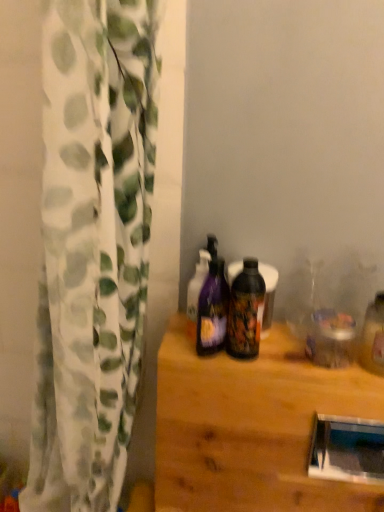
What is the approximate width of wooden table at center?

It is 7.88 inches.

How much space does purple glossy bottle at center, the 2th bottle when ordered from right to left, occupy horizontally?

The width of purple glossy bottle at center, the 2th bottle when ordered from right to left, is 2.33 inches.

What do you see at coordinates (246, 311) in the screenshot? I see `glossy plastic bottle at center, the first bottle in the right-to-left sequence` at bounding box center [246, 311].

Locate an element on the screen. The image size is (384, 512). wooden table at center is located at coordinates tap(252, 426).

Could wooden table at center be considered to be inside white textured curtain at left?

No, wooden table at center is located outside of white textured curtain at left.

At what (x,y) coordinates should I click in order to perform the action: click on table below the white textured curtain at left (from a real-world perspective). Please return your answer as a coordinate pair (x, y). The height and width of the screenshot is (512, 384). Looking at the image, I should click on (252, 426).

In the scene shown: Relative to wooden table at center, is white textured curtain at left in front or behind?

white textured curtain at left is positioned closer to the viewer than wooden table at center.

Considering the relative sizes of wooden table at center and white textured curtain at left in the image provided, is wooden table at center smaller than white textured curtain at left?

Yes.

Is wooden table at center positioned beyond the bounds of white textured curtain at left?

Absolutely, wooden table at center is external to white textured curtain at left.

From a real-world perspective, does wooden table at center stand above white textured curtain at left?

No, from a real-world perspective, wooden table at center is not on top of white textured curtain at left.

In the scene shown: From the image's perspective, which object appears higher, purple glossy bottle at center, the first bottle from the left, or wooden table at center?

purple glossy bottle at center, the first bottle from the left, is shown above in the image.

Is purple glossy bottle at center, the first bottle from the left, far away from wooden table at center?

That's not correct — purple glossy bottle at center, the first bottle from the left, is a little close to wooden table at center.

Consider the image. Looking at the image, does purple glossy bottle at center, the 2th bottle when ordered from right to left, seem bigger or smaller compared to wooden table at center?

purple glossy bottle at center, the 2th bottle when ordered from right to left, is smaller than wooden table at center.

What's the angular difference between purple glossy bottle at center, the 2th bottle when ordered from right to left, and wooden table at center's facing directions?

There is a 16.7-degree angle between the facing directions of purple glossy bottle at center, the 2th bottle when ordered from right to left, and wooden table at center.

Between point (52, 336) and point (226, 308), which one is positioned in front?

The point (52, 336) is closer to the camera.

Is white textured curtain at left far from purple glossy bottle at center, the first bottle from the left?

No.

From the image's perspective, which one is positioned higher, white textured curtain at left or purple glossy bottle at center, the first bottle from the left?

purple glossy bottle at center, the first bottle from the left, appears higher in the image.

Considering the relative sizes of white textured curtain at left and purple glossy bottle at center, the 2th bottle when ordered from right to left, in the image provided, is white textured curtain at left bigger than purple glossy bottle at center, the 2th bottle when ordered from right to left,?

Yes.

Which object is positioned more to the right, glossy plastic bottle at center, which is the 2th bottle in left-to-right order, or purple glossy bottle at center, the first bottle from the left?

glossy plastic bottle at center, which is the 2th bottle in left-to-right order, is more to the right.

From a real-world perspective, is glossy plastic bottle at center, the first bottle in the right-to-left sequence, above or below purple glossy bottle at center, the first bottle from the left?

glossy plastic bottle at center, the first bottle in the right-to-left sequence, is situated higher than purple glossy bottle at center, the first bottle from the left, in the real world.

Which object is more forward, glossy plastic bottle at center, the first bottle in the right-to-left sequence, or purple glossy bottle at center, the 2th bottle when ordered from right to left?

Positioned in front is glossy plastic bottle at center, the first bottle in the right-to-left sequence.

Is purple glossy bottle at center, the first bottle from the left, at the back of glossy plastic bottle at center, which is the 2th bottle in left-to-right order?

glossy plastic bottle at center, which is the 2th bottle in left-to-right order, is not turned away from purple glossy bottle at center, the first bottle from the left.

In terms of size, does purple glossy bottle at center, the 2th bottle when ordered from right to left, appear bigger or smaller than white textured curtain at left?

Considering their sizes, purple glossy bottle at center, the 2th bottle when ordered from right to left, takes up less space than white textured curtain at left.

Considering the positions of objects purple glossy bottle at center, the 2th bottle when ordered from right to left, and white textured curtain at left in the image provided, who is in front, purple glossy bottle at center, the 2th bottle when ordered from right to left, or white textured curtain at left?

white textured curtain at left.

Is purple glossy bottle at center, the 2th bottle when ordered from right to left, facing towards white textured curtain at left?

No.

Would you say purple glossy bottle at center, the 2th bottle when ordered from right to left, contains white textured curtain at left?

No, white textured curtain at left is located outside of purple glossy bottle at center, the 2th bottle when ordered from right to left.

Considering the sizes of glossy plastic bottle at center, which is the 2th bottle in left-to-right order, and white textured curtain at left in the image, is glossy plastic bottle at center, which is the 2th bottle in left-to-right order, bigger or smaller than white textured curtain at left?

Clearly, glossy plastic bottle at center, which is the 2th bottle in left-to-right order, is smaller in size than white textured curtain at left.

Considering the relative sizes of glossy plastic bottle at center, which is the 2th bottle in left-to-right order, and white textured curtain at left in the image provided, is glossy plastic bottle at center, which is the 2th bottle in left-to-right order, wider than white textured curtain at left?

Incorrect, the width of glossy plastic bottle at center, which is the 2th bottle in left-to-right order, does not surpass that of white textured curtain at left.

Which object is positioned more to the left, glossy plastic bottle at center, which is the 2th bottle in left-to-right order, or white textured curtain at left?

white textured curtain at left.

In order to click on curtain that is on the left side of wooden table at center in this screenshot , I will do `click(92, 247)`.

Locate an element on the screen. table lying below the white textured curtain at left (from the image's perspective) is located at coordinates (252, 426).

When comparing their distances from wooden table at center, does white textured curtain at left or glossy plastic bottle at center, which is the 2th bottle in left-to-right order, seem closer?

Based on the image, glossy plastic bottle at center, which is the 2th bottle in left-to-right order, appears to be nearer to wooden table at center.

Estimate the real-world distances between objects in this image. Which object is closer to purple glossy bottle at center, the first bottle from the left, white textured curtain at left or glossy plastic bottle at center, the first bottle in the right-to-left sequence?

Among the two, glossy plastic bottle at center, the first bottle in the right-to-left sequence, is located nearer to purple glossy bottle at center, the first bottle from the left.

Looking at the image, which one is located further to purple glossy bottle at center, the first bottle from the left, glossy plastic bottle at center, the first bottle in the right-to-left sequence, or wooden table at center?

wooden table at center.

Looking at the image, which one is located closer to white textured curtain at left, glossy plastic bottle at center, the first bottle in the right-to-left sequence, or purple glossy bottle at center, the 2th bottle when ordered from right to left?

purple glossy bottle at center, the 2th bottle when ordered from right to left, is closer to white textured curtain at left.

Looking at the image, which one is located closer to glossy plastic bottle at center, which is the 2th bottle in left-to-right order, purple glossy bottle at center, the 2th bottle when ordered from right to left, or white textured curtain at left?

Based on the image, purple glossy bottle at center, the 2th bottle when ordered from right to left, appears to be nearer to glossy plastic bottle at center, which is the 2th bottle in left-to-right order.

Based on their spatial positions, is glossy plastic bottle at center, the first bottle in the right-to-left sequence, or white textured curtain at left closer to purple glossy bottle at center, the 2th bottle when ordered from right to left?

glossy plastic bottle at center, the first bottle in the right-to-left sequence.

From the picture: Considering their positions, is white textured curtain at left positioned closer to glossy plastic bottle at center, the first bottle in the right-to-left sequence, than purple glossy bottle at center, the 2th bottle when ordered from right to left?

purple glossy bottle at center, the 2th bottle when ordered from right to left, lies closer to glossy plastic bottle at center, the first bottle in the right-to-left sequence, than the other object.

Which object lies further to the anchor point glossy plastic bottle at center, the first bottle in the right-to-left sequence, wooden table at center or purple glossy bottle at center, the first bottle from the left?

wooden table at center is further to glossy plastic bottle at center, the first bottle in the right-to-left sequence.

At what (x,y) coordinates should I click in order to perform the action: click on bottle between glossy plastic bottle at center, the first bottle in the right-to-left sequence, and wooden table at center in the up-down direction. Please return your answer as a coordinate pair (x, y). Looking at the image, I should click on (212, 310).

Where is `bottle between white textured curtain at left and purple glossy bottle at center, the 2th bottle when ordered from right to left, from front to back`? bottle between white textured curtain at left and purple glossy bottle at center, the 2th bottle when ordered from right to left, from front to back is located at coordinates (246, 311).